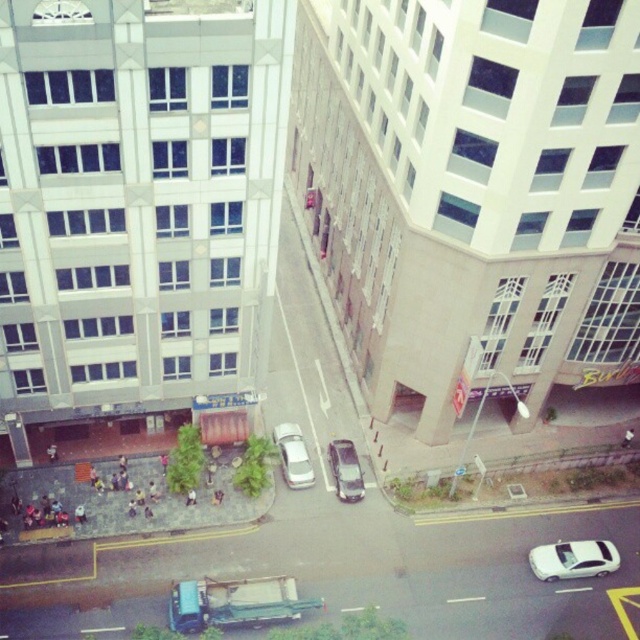
Who is more distant from viewer, (545, 573) or (348, 483)?

The point (348, 483) is behind.

Between white matte car at lower right and satin silver car at center, which one appears on the left side from the viewer's perspective?

satin silver car at center

Where is `white matte car at lower right`? This screenshot has height=640, width=640. white matte car at lower right is located at coordinates click(x=573, y=560).

Locate an element on the screen. white matte car at lower right is located at coordinates (573, 560).

Which is behind, point (532, 566) or point (275, 429)?

Positioned behind is point (275, 429).

What do you see at coordinates (573, 560) in the screenshot? I see `white matte car at lower right` at bounding box center [573, 560].

Find the location of `white matte car at lower right`. white matte car at lower right is located at coordinates (573, 560).

Is point (307, 472) in front of point (355, 468)?

Yes, point (307, 472) is closer to viewer.

Which of these two, white matte car at center or satin silver car at center, stands taller?

white matte car at center is taller.

Is point (291, 458) less distant than point (342, 454)?

Yes, point (291, 458) is in front of point (342, 454).

The height and width of the screenshot is (640, 640). Identify the location of white matte car at center. (292, 456).